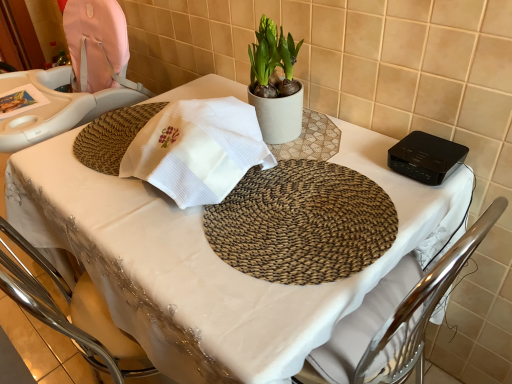
Question: Do you think black plastic device at upper right is within matte beige pot at center, or outside of it?

Choices:
 (A) outside
 (B) inside

Answer: (A)

Question: Considering their positions, is black plastic device at upper right located in front of or behind matte beige pot at center?

Choices:
 (A) front
 (B) behind

Answer: (A)

Question: In the image, is black plastic device at upper right on the left side or the right side of matte beige pot at center?

Choices:
 (A) left
 (B) right

Answer: (B)

Question: From their relative heights in the image, would you say matte beige pot at center is taller or shorter than black plastic device at upper right?

Choices:
 (A) short
 (B) tall

Answer: (B)

Question: Is matte beige pot at center wider or thinner than black plastic device at upper right?

Choices:
 (A) wide
 (B) thin

Answer: (B)

Question: From the image's perspective, is matte beige pot at center positioned above or below black plastic device at upper right?

Choices:
 (A) below
 (B) above

Answer: (B)

Question: Would you say matte beige pot at center is to the left or to the right of black plastic device at upper right in the picture?

Choices:
 (A) left
 (B) right

Answer: (A)